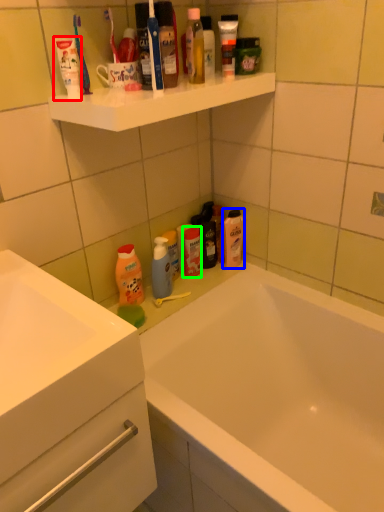
Question: Which object is the farthest from toothpaste (highlighted by a red box)? Choose among these: mouthwash (highlighted by a blue box) or toiletry (highlighted by a green box).

Choices:
 (A) mouthwash
 (B) toiletry

Answer: (A)